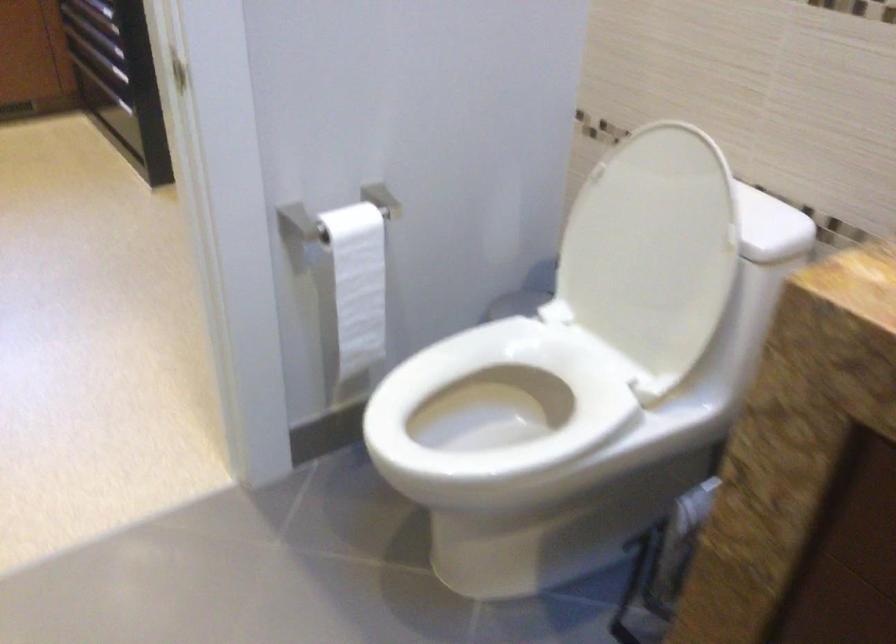
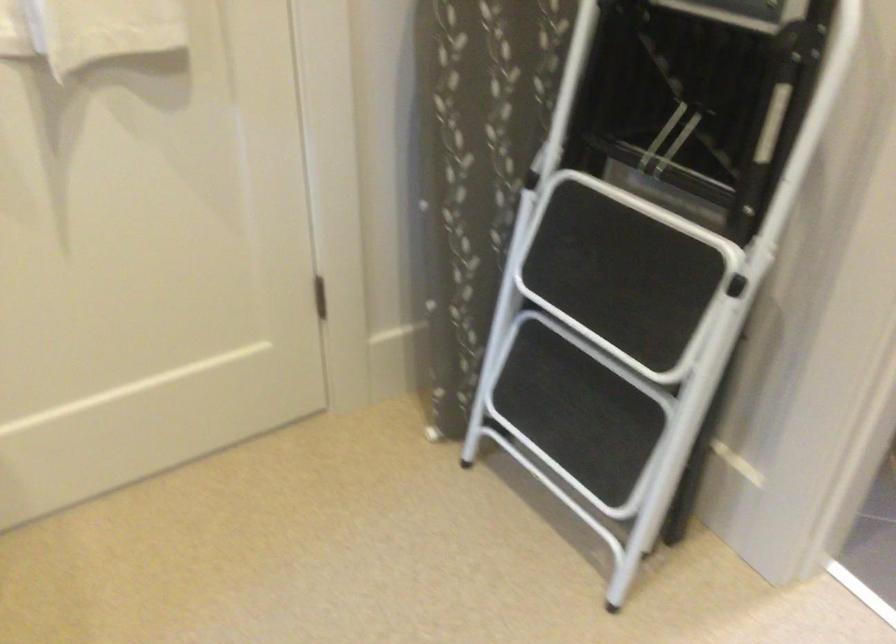
Question: I am providing you with two images of the same scene from different viewpoints. Please identify which objects are invisible in image2.

Choices:
 (A) folding step ladder
 (B) white toilet lid
 (C) white towel
 (D) towel dispenser slot

Answer: (B)